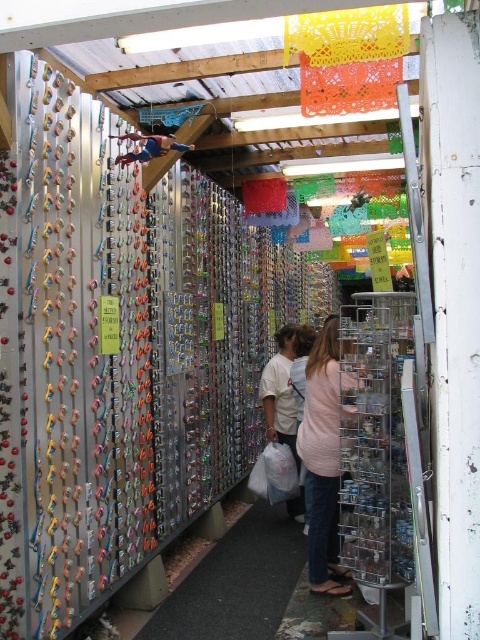
Question: Can you confirm if pink fabric shirt at center is positioned below white matte plastic bag at center?

Choices:
 (A) no
 (B) yes

Answer: (A)

Question: Which object is farther from the camera taking this photo?

Choices:
 (A) pink fabric shirt at center
 (B) blue fabric at upper center
 (C) white matte plastic bag at center

Answer: (C)

Question: Which point is farther from the camera taking this photo?

Choices:
 (A) (142, 154)
 (B) (285, 333)
 (C) (307, 483)

Answer: (B)

Question: Where is pink fabric shirt at center located in relation to white matte plastic bag at center in the image?

Choices:
 (A) above
 (B) below

Answer: (A)

Question: Which object is farther from the camera taking this photo?

Choices:
 (A) pink fabric shirt at center
 (B) blue fabric at upper center

Answer: (A)

Question: Is white matte plastic bag at center positioned in front of blue fabric at upper center?

Choices:
 (A) no
 (B) yes

Answer: (A)